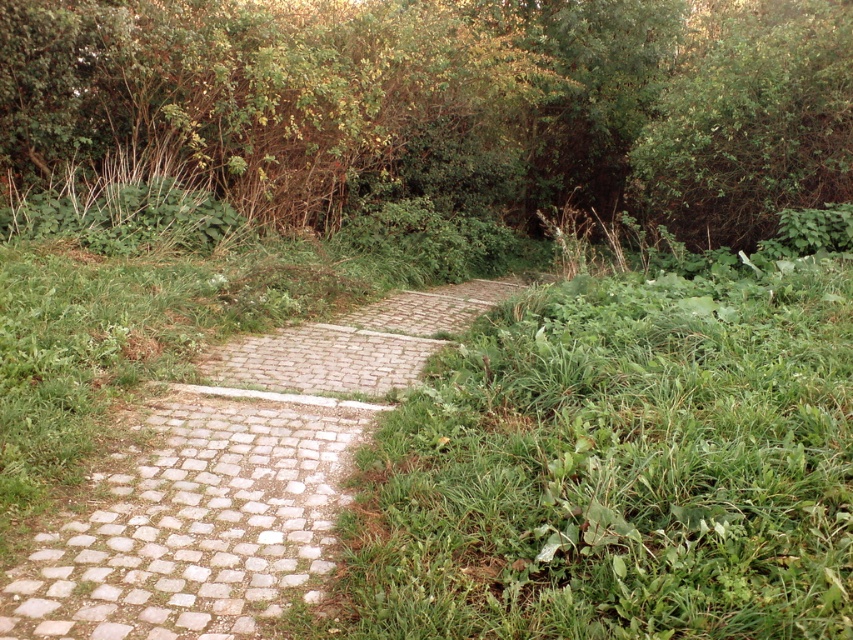
You are a gardener planning to trim the green leafy bush at upper center and the pebble stone path at center. Based on their heights, which one requires more attention to avoid blocking the pathway?

The green leafy bush at upper center requires more attention because it is much taller than the pebble stone path at center, which could block the pathway if not trimmed.

You are a gardener who needs to mow the lawn. You see the green leafy bush at upper center and the pebble stone path at center. Which object is closer to you?

The green leafy bush at upper center is closer to you because it is in front of the pebble stone path at center.

You are a gardener trying to mow the lawn around the green leafy bush at upper center and the pebble stone path at center. Which object requires more space to work around due to its size?

The green leafy bush at upper center requires more space to work around because it is larger in size than the pebble stone path at center.